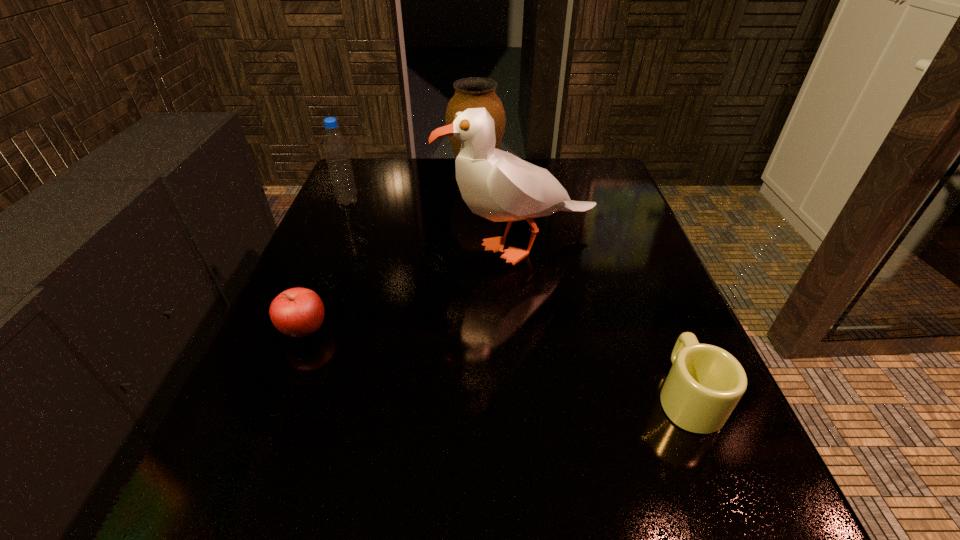
Identify the location of gull. (497, 185).

Identify the location of the third farthest object. This screenshot has height=540, width=960. (497, 185).

What are the coordinates of `the farthest object` in the screenshot? It's located at (474, 92).

The width and height of the screenshot is (960, 540). Find the location of `water bottle`. water bottle is located at coordinates (335, 147).

I want to click on the rightmost object, so click(705, 383).

At what (x,y) coordinates should I click in order to perform the action: click on mug. Please return your answer as a coordinate pair (x, y). Image resolution: width=960 pixels, height=540 pixels. Looking at the image, I should click on (705, 383).

Locate an element on the screen. This screenshot has height=540, width=960. apple is located at coordinates (298, 312).

Find the location of a particular element. The image size is (960, 540). vacant area situated 0.230m at the beak of the gull is located at coordinates (336, 247).

You are a GUI agent. You are given a task and a screenshot of the screen. Output one action in this format:
    pyautogui.click(x=<x>, y=<y>)
    Task: Click on the free space located 0.070m at the beak of the gull
    This screenshot has height=540, width=960.
    Given the screenshot: What is the action you would take?
    pyautogui.click(x=409, y=247)

Find the location of a particular element. The height and width of the screenshot is (540, 960). vacant space located 0.090m at the beak of the gull is located at coordinates (400, 247).